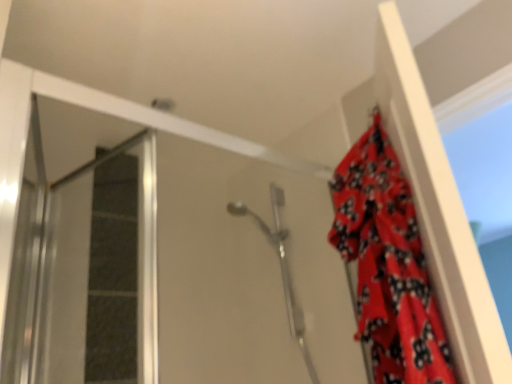
Question: Considering the positions of red fabric curtain at upper right and satin silver shower head at center in the image, is red fabric curtain at upper right wider or thinner than satin silver shower head at center?

Choices:
 (A) thin
 (B) wide

Answer: (A)

Question: From a real-world perspective, relative to satin silver shower head at center, is red fabric curtain at upper right vertically above or below?

Choices:
 (A) below
 (B) above

Answer: (A)

Question: Estimate the real-world distances between objects in this image. Which object is closer to the satin silver shower head at center?

Choices:
 (A) transparent glass screen door at left
 (B) red fabric curtain at upper right

Answer: (B)

Question: Which object is the closest to the satin silver shower head at center?

Choices:
 (A) transparent glass screen door at left
 (B) red fabric curtain at upper right

Answer: (B)